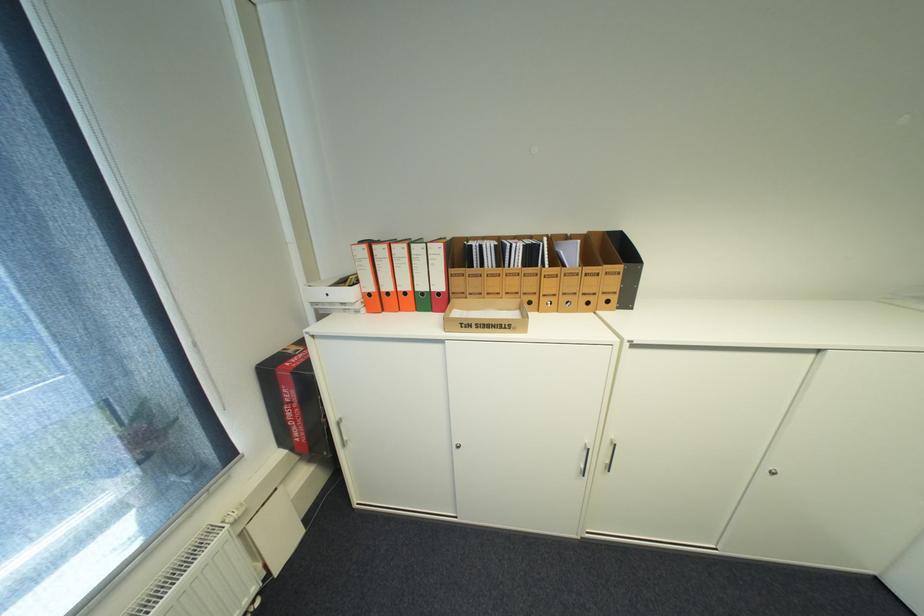
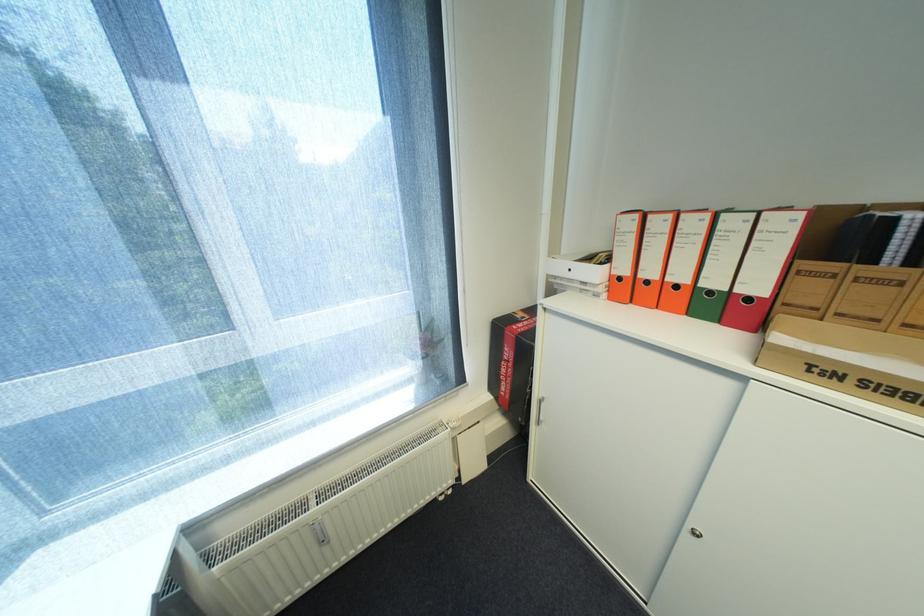
The point at (x=307, y=351) is marked in the first image. Where is the corresponding point in the second image?

(532, 318)